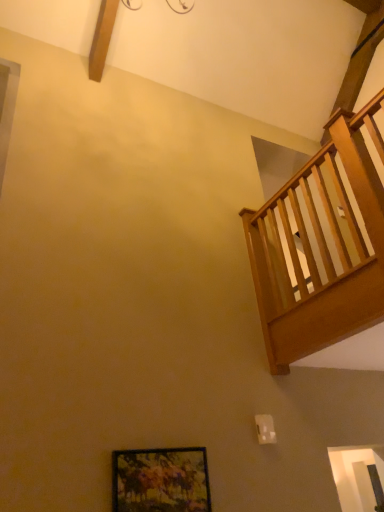
What do you see at coordinates (322, 248) in the screenshot? Image resolution: width=384 pixels, height=512 pixels. I see `wooden railing at upper right` at bounding box center [322, 248].

The width and height of the screenshot is (384, 512). What are the coordinates of `wooden railing at upper right` in the screenshot? It's located at (322, 248).

Find the location of a particular element. wooden-framed painting at lower center is located at coordinates (160, 480).

This screenshot has width=384, height=512. What do you see at coordinates (160, 480) in the screenshot? I see `wooden-framed painting at lower center` at bounding box center [160, 480].

Locate an element on the screen. Image resolution: width=384 pixels, height=512 pixels. wooden railing at upper right is located at coordinates (322, 248).

Visually, is wooden railing at upper right positioned to the left or to the right of wooden-framed painting at lower center?

From the image, it's evident that wooden railing at upper right is to the right of wooden-framed painting at lower center.

Does wooden railing at upper right come behind wooden-framed painting at lower center?

No, the depth of wooden railing at upper right is less than that of wooden-framed painting at lower center.

Is point (380, 93) behind point (202, 492)?

Yes, it is behind point (202, 492).

From the image's perspective, does wooden railing at upper right appear lower than wooden-framed painting at lower center?

Actually, wooden railing at upper right appears above wooden-framed painting at lower center in the image.

From a real-world perspective, which is physically above, wooden railing at upper right or wooden-framed painting at lower center?

In real-world perspective, wooden railing at upper right is above.

In terms of width, does wooden railing at upper right look wider or thinner when compared to wooden-framed painting at lower center?

Clearly, wooden railing at upper right has more width compared to wooden-framed painting at lower center.

Does wooden railing at upper right have a lesser height compared to wooden-framed painting at lower center?

No.

Considering the relative sizes of wooden railing at upper right and wooden-framed painting at lower center in the image provided, is wooden railing at upper right bigger than wooden-framed painting at lower center?

Indeed, wooden railing at upper right has a larger size compared to wooden-framed painting at lower center.

Is wooden-framed painting at lower center surrounded by wooden railing at upper right?

That's incorrect, wooden-framed painting at lower center is not inside wooden railing at upper right.

Would you say wooden railing at upper right is a long distance from wooden-framed painting at lower center?

That's right, there is a large distance between wooden railing at upper right and wooden-framed painting at lower center.

Is wooden railing at upper right facing towards wooden-framed painting at lower center?

No, wooden railing at upper right is not aimed at wooden-framed painting at lower center.

Can you tell me how much wooden railing at upper right and wooden-framed painting at lower center differ in facing direction?

The angular difference between wooden railing at upper right and wooden-framed painting at lower center is 87.5 degrees.

Locate an element on the screen. This screenshot has height=512, width=384. picture frame behind the wooden railing at upper right is located at coordinates (160, 480).

Does wooden-framed painting at lower center appear on the left side of wooden railing at upper right?

Yes, wooden-framed painting at lower center is to the left of wooden railing at upper right.

Consider the image. Does wooden-framed painting at lower center lie behind wooden railing at upper right?

Yes, wooden-framed painting at lower center is further from the camera.

Considering the points (142, 458) and (326, 263), which point is in front, point (142, 458) or point (326, 263)?

The point (142, 458) is closer to the camera.

From the image's perspective, is wooden-framed painting at lower center on top of wooden railing at upper right?

Incorrect, from the image's perspective, wooden-framed painting at lower center is lower than wooden railing at upper right.

From a real-world perspective, who is located higher, wooden-framed painting at lower center or wooden railing at upper right?

In real-world perspective, wooden railing at upper right is above.

Is wooden-framed painting at lower center wider or thinner than wooden railing at upper right?

wooden-framed painting at lower center is thinner than wooden railing at upper right.

Based on the photo, considering the relative sizes of wooden-framed painting at lower center and wooden railing at upper right in the image provided, is wooden-framed painting at lower center taller than wooden railing at upper right?

In fact, wooden-framed painting at lower center may be shorter than wooden railing at upper right.

Which of these two, wooden-framed painting at lower center or wooden railing at upper right, is smaller?

wooden-framed painting at lower center is smaller.

Is wooden-framed painting at lower center completely or partially outside of wooden railing at upper right?

wooden-framed painting at lower center lies outside wooden railing at upper right's area.

Is there a large distance between wooden-framed painting at lower center and wooden railing at upper right?

Yes.

Is wooden-framed painting at lower center oriented away from wooden railing at upper right?

No.

How different are the orientations of wooden-framed painting at lower center and wooden railing at upper right in degrees?

The angular difference between wooden-framed painting at lower center and wooden railing at upper right is 87.5 degrees.

How far apart are wooden-framed painting at lower center and wooden railing at upper right?

wooden-framed painting at lower center and wooden railing at upper right are 4.51 feet apart from each other.

The height and width of the screenshot is (512, 384). What are the coordinates of `balcony above the wooden-framed painting at lower center (from a real-world perspective)` in the screenshot? It's located at (322, 248).

This screenshot has width=384, height=512. I want to click on balcony that appears on the right of wooden-framed painting at lower center, so click(x=322, y=248).

Locate an element on the screen. This screenshot has width=384, height=512. balcony in front of the wooden-framed painting at lower center is located at coordinates (322, 248).